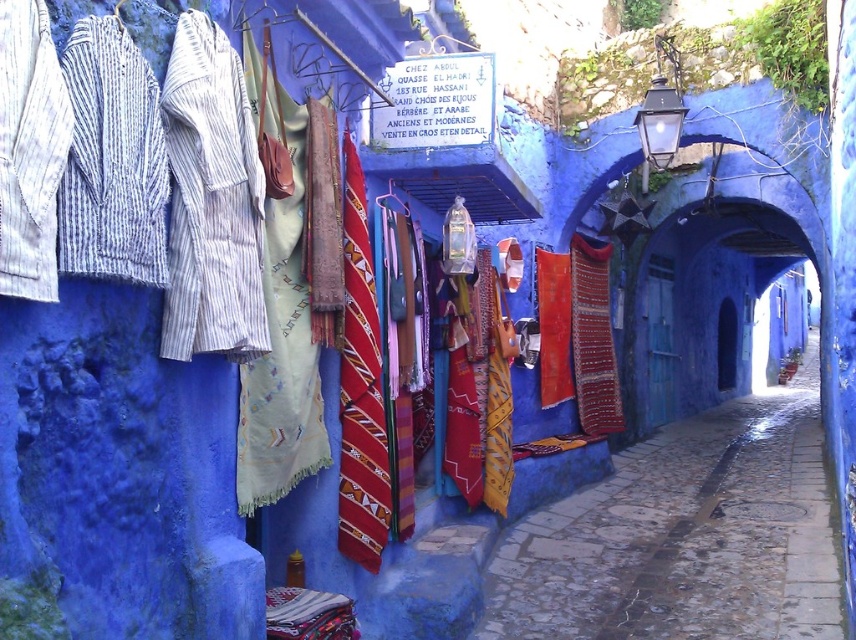
Question: Considering the real-world distances, which object is farthest from the red woven fabric tie at center?

Choices:
 (A) smooth cobblestone alley at center
 (B) matte fabric bag at center

Answer: (A)

Question: Is the position of smooth cobblestone alley at center less distant than that of matte fabric bag at center?

Choices:
 (A) yes
 (B) no

Answer: (A)

Question: Does smooth cobblestone alley at center have a smaller size compared to matte fabric bag at center?

Choices:
 (A) no
 (B) yes

Answer: (A)

Question: Based on their relative distances, which object is farther from the smooth cobblestone alley at center?

Choices:
 (A) red woven fabric tie at center
 (B) matte fabric bag at center

Answer: (B)

Question: Which point appears farthest from the camera in this image?

Choices:
 (A) (807, 611)
 (B) (391, 200)
 (C) (346, 332)

Answer: (B)

Question: Does red woven fabric tie at center appear over matte fabric bag at center?

Choices:
 (A) no
 (B) yes

Answer: (A)